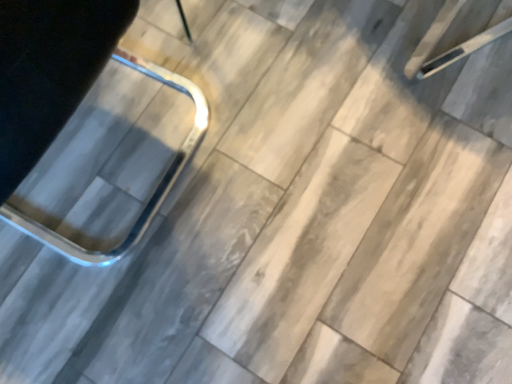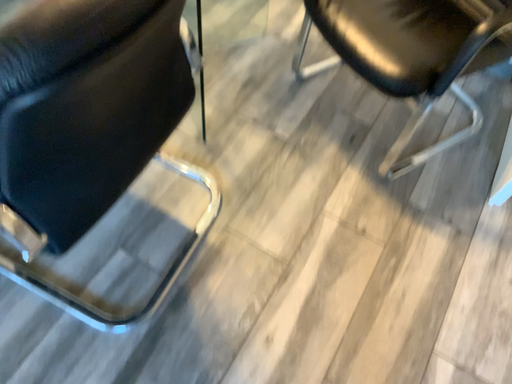
Question: Which way did the camera rotate in the video?

Choices:
 (A) rotated upward
 (B) rotated downward

Answer: (A)